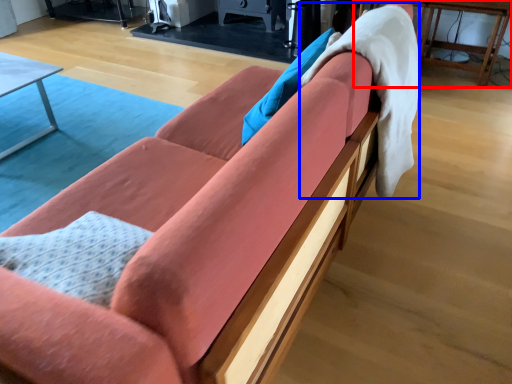
Question: Among these objects, which one is nearest to the camera, table (highlighted by a red box) or blanket (highlighted by a blue box)?

Choices:
 (A) table
 (B) blanket

Answer: (B)